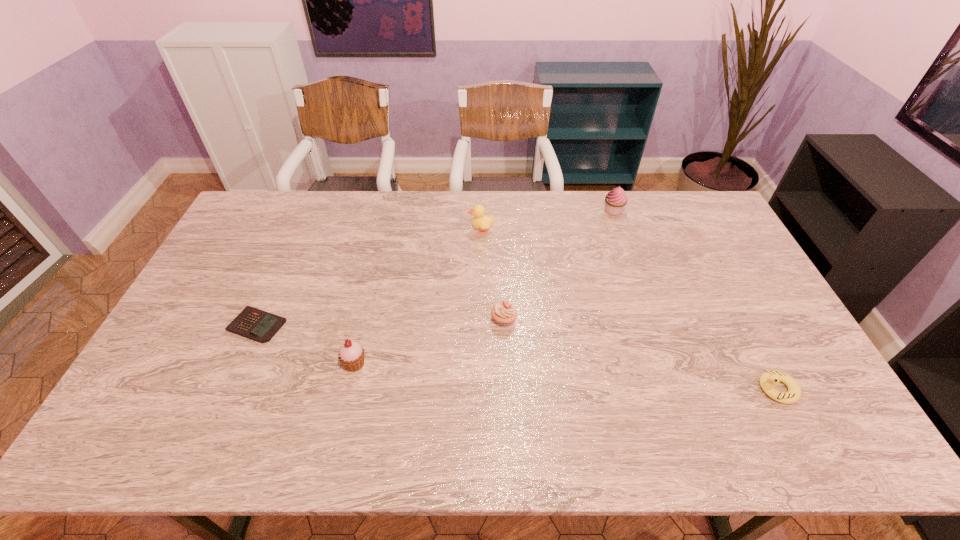
This screenshot has height=540, width=960. In order to click on free space located 0.360m on the right of the calculator in this screenshot , I will do `click(410, 326)`.

Where is `cupcake at the far edge`? cupcake at the far edge is located at coordinates (616, 199).

At what (x,y) coordinates should I click in order to perform the action: click on duckling that is at the far edge. Please return your answer as a coordinate pair (x, y). The image size is (960, 540). Looking at the image, I should click on (480, 221).

Identify the location of object that is positioned at the left edge. The width and height of the screenshot is (960, 540). (252, 323).

Locate an element on the screen. Image resolution: width=960 pixels, height=540 pixels. object positioned at the right edge is located at coordinates (769, 379).

This screenshot has height=540, width=960. Find the location of `free space at the far edge of the desktop`. free space at the far edge of the desktop is located at coordinates (530, 198).

The height and width of the screenshot is (540, 960). In the image, there is a desktop. Identify the location of vacant space at the near edge. (570, 440).

Image resolution: width=960 pixels, height=540 pixels. Identify the location of free region at the left edge of the desktop. (210, 307).

The image size is (960, 540). What are the coordinates of `free space at the far left corner of the desktop` in the screenshot? It's located at (292, 197).

This screenshot has width=960, height=540. In order to click on unoccupied area between the second farthest cupcake and the right duckling in this screenshot , I will do `click(640, 354)`.